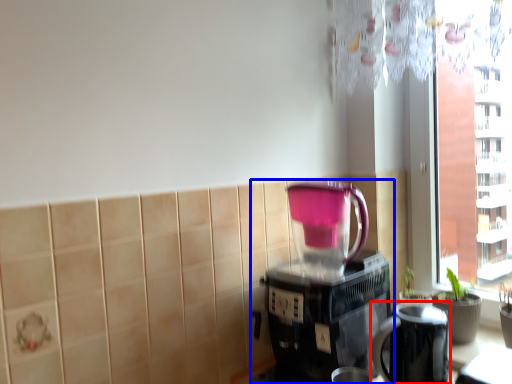
Question: Which point is closer to the camera, appliance (highlighted by a red box) or coffee maker (highlighted by a blue box)?

Choices:
 (A) appliance
 (B) coffee maker

Answer: (A)